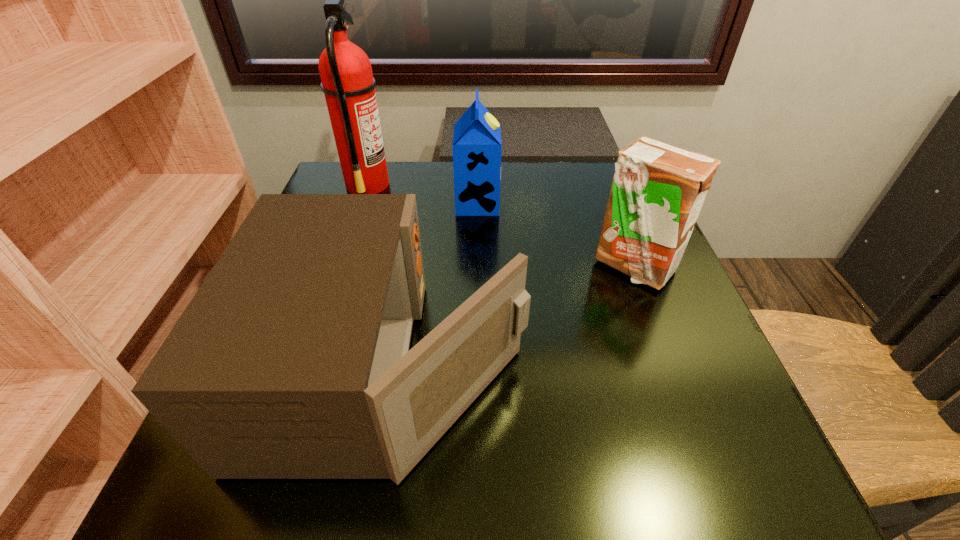
Locate an element on the screen. the tallest object is located at coordinates (347, 82).

The height and width of the screenshot is (540, 960). I want to click on the left carton, so click(x=477, y=146).

I want to click on the right carton, so (x=658, y=190).

Identify the location of the nearer carton. (658, 190).

Where is `microwave oven`? This screenshot has width=960, height=540. microwave oven is located at coordinates (292, 361).

Locate an element on the screen. Image resolution: width=960 pixels, height=540 pixels. free space located on the side of the fire extinguisher near the handle is located at coordinates (469, 184).

At what (x,y) coordinates should I click in order to perform the action: click on free space located 0.160m with the cap open on the left carton. Please return your answer as a coordinate pair (x, y). This screenshot has height=540, width=960. Looking at the image, I should click on (566, 204).

The height and width of the screenshot is (540, 960). Identify the location of vacant space positioned 0.350m on the straw side of the rightmost object. (717, 484).

Locate an element on the screen. vacant space situated 0.210m with the door open on the front of the shortest object is located at coordinates (657, 368).

This screenshot has width=960, height=540. What are the coordinates of `fire extinguisher that is positioned at the far edge` in the screenshot? It's located at (347, 82).